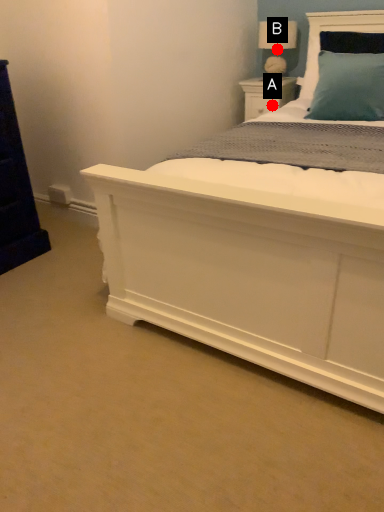
Question: Two points are circled on the image, labeled by A and B beside each circle. Which point is closer to the camera?

Choices:
 (A) A is closer
 (B) B is closer

Answer: (B)